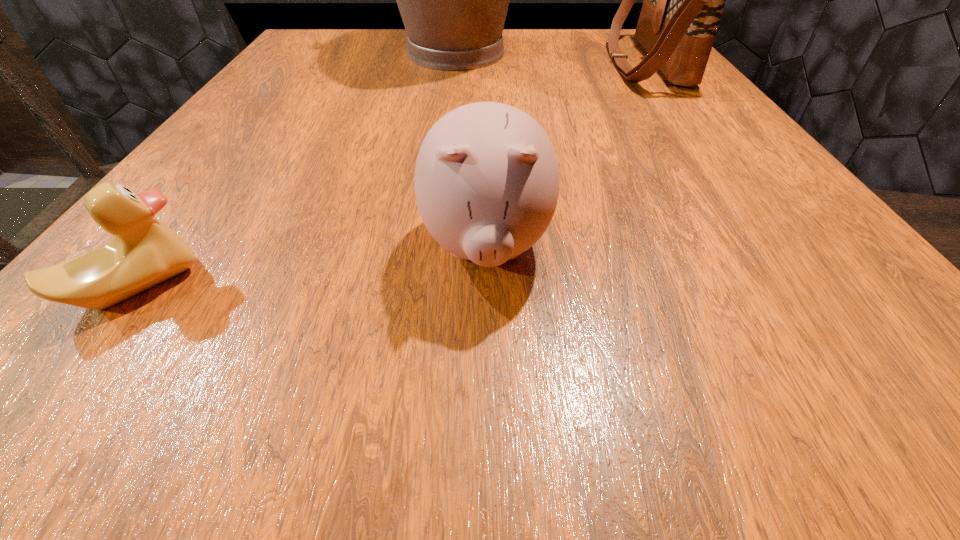
At what (x,y) coordinates should I click in order to perform the action: click on vacant space at the near edge of the desktop. Please return your answer as a coordinate pair (x, y). The height and width of the screenshot is (540, 960). Looking at the image, I should click on (687, 356).

I want to click on free space at the left edge, so tap(300, 92).

In the image, there is a desktop. At what (x,y) coordinates should I click in order to perform the action: click on free region at the right edge. Please return your answer as a coordinate pair (x, y). Looking at the image, I should click on (686, 88).

Locate an element on the screen. The height and width of the screenshot is (540, 960). free spot at the far left corner of the desktop is located at coordinates (320, 30).

Image resolution: width=960 pixels, height=540 pixels. In the image, there is a desktop. Identify the location of vacant space at the near left corner. (161, 394).

What are the coordinates of `blank area at the far right corner` in the screenshot? It's located at (627, 29).

This screenshot has width=960, height=540. Find the location of `free region at the near right corner`. free region at the near right corner is located at coordinates (929, 389).

This screenshot has width=960, height=540. I want to click on vacant space in between the shoulder bag and the piggy bank, so click(565, 154).

The height and width of the screenshot is (540, 960). I want to click on free spot between the tallest object and the rightmost object, so click(x=551, y=58).

Where is `empty location between the piggy bank and the shortest object`? This screenshot has width=960, height=540. empty location between the piggy bank and the shortest object is located at coordinates (312, 266).